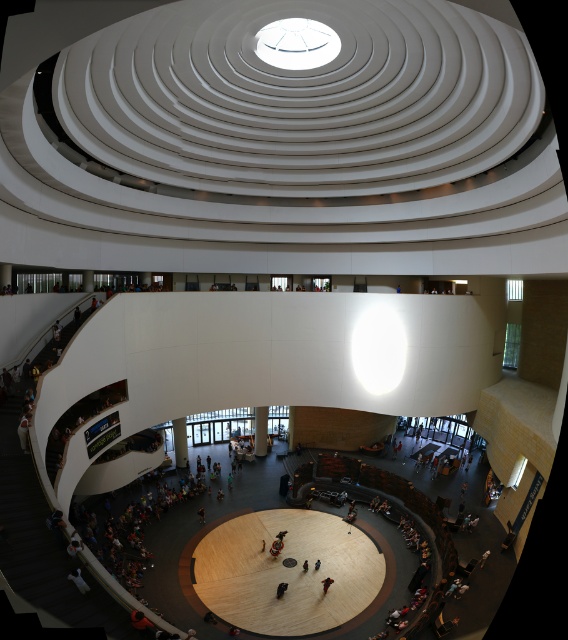
You are an event planner setting up a stage in the circular building. The stage requires a 30 feet clearance between any obstacles. Is the distance between the white smooth pillar at center and dark blue jeans at center sufficient for the stage setup?

The distance between the white smooth pillar at center and dark blue jeans at center is 40.63 feet, which is greater than the required 30 feet clearance. Therefore, the distance is sufficient for the stage setup.

You are standing in the atrium of the circular building and want to take a photo of both the point at coordinates point [176,444] and point [318,566]. Which point should you focus on first to ensure both are in sharp focus?

A: You should focus on point [176,444] first because it is closer to the camera than point [318,566]. This ensures that both points will be in focus as the depth of field will cover the distance between them.

Based on the photo, you are standing in the atrium and see both the white smooth pillar at center and the dark brown leather jacket at center. Which object is positioned to the left when facing the front of the building?

The white smooth pillar at center is to the left of the dark brown leather jacket at center when facing the front of the building.